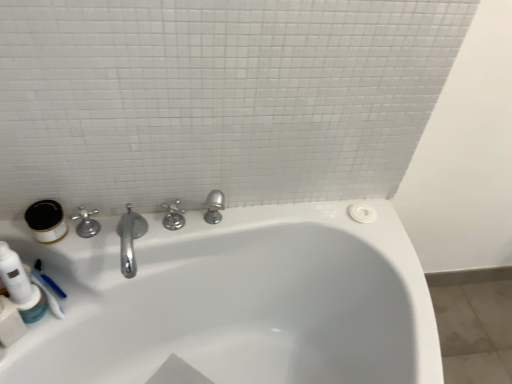
You are a GUI agent. You are given a task and a screenshot of the screen. Output one action in this format:
    pyautogui.click(x=<x>, y=<y>)
    Task: Click on the free location to the left of polished chrome faucet at center, which is the 1th tap in right-to-left order
    
    Given the screenshot: What is the action you would take?
    pyautogui.click(x=124, y=229)